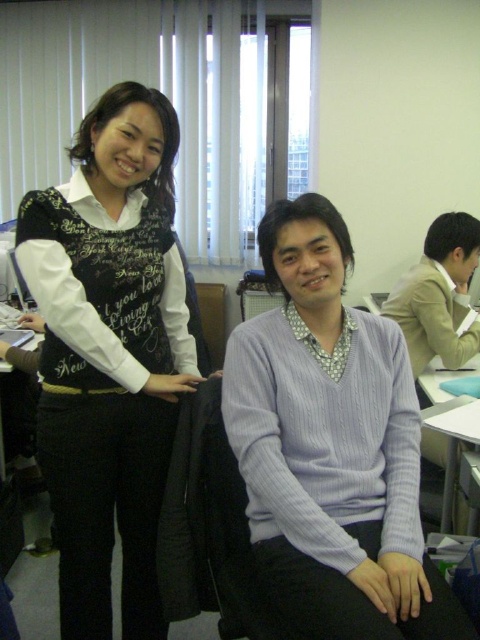
How far apart are purple ribbed sweater at center and light brown wool sweater at center?

purple ribbed sweater at center is 37.55 inches away from light brown wool sweater at center.

Is purple ribbed sweater at center closer to the viewer compared to light brown wool sweater at center?

That is True.

Between point (338, 525) and point (423, 273), which one is positioned in front?

Point (338, 525)

The image size is (480, 640). In order to click on purple ribbed sweater at center in this screenshot , I will do `click(331, 445)`.

Does point (120, 515) come behind point (380, 387)?

Yes, it is behind point (380, 387).

Is black matte vest at left below purple ribbed sweater at center?

Incorrect, black matte vest at left is not positioned below purple ribbed sweater at center.

Image resolution: width=480 pixels, height=640 pixels. I want to click on black matte vest at left, so coord(109,353).

Identify the location of black matte vest at left. This screenshot has width=480, height=640. (109, 353).

Is black matte vest at left to the right of light brown wool sweater at center from the viewer's perspective?

In fact, black matte vest at left is to the left of light brown wool sweater at center.

What are the coordinates of `black matte vest at left` in the screenshot? It's located at (109, 353).